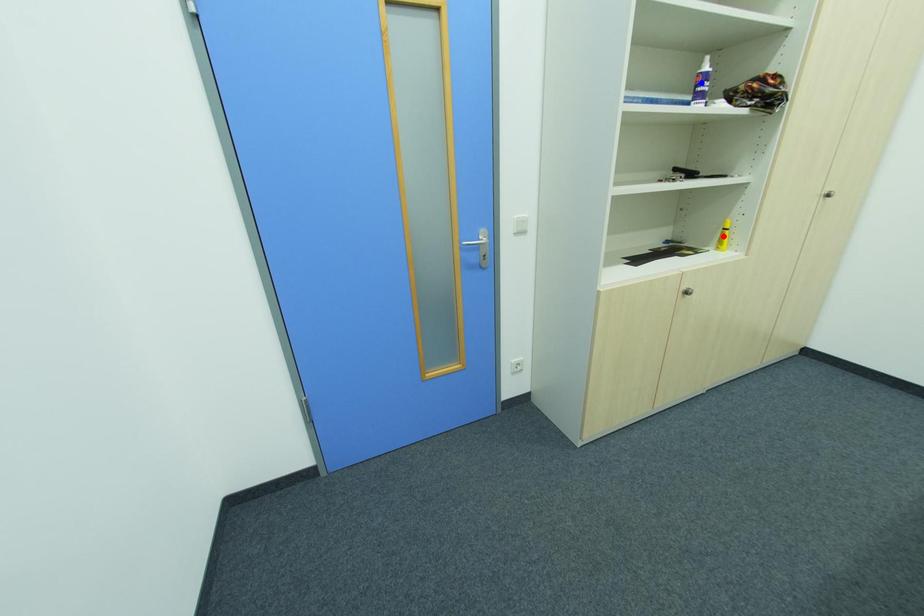
Question: Which of the two points in the image is closer to the camera?

Choices:
 (A) Blue point is closer.
 (B) Red point is closer.

Answer: (A)